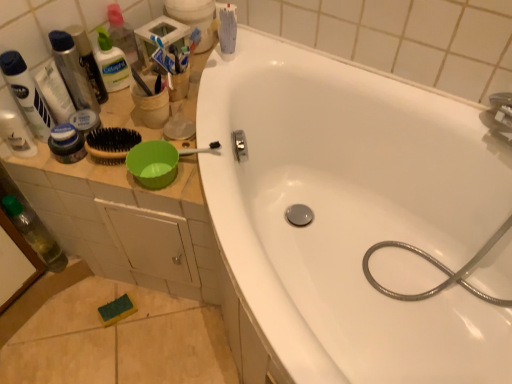
Where is `free spot in front of shiny metallic can at upper left, the 1th toiletry viewed from the right`? The image size is (512, 384). free spot in front of shiny metallic can at upper left, the 1th toiletry viewed from the right is located at coordinates (90, 161).